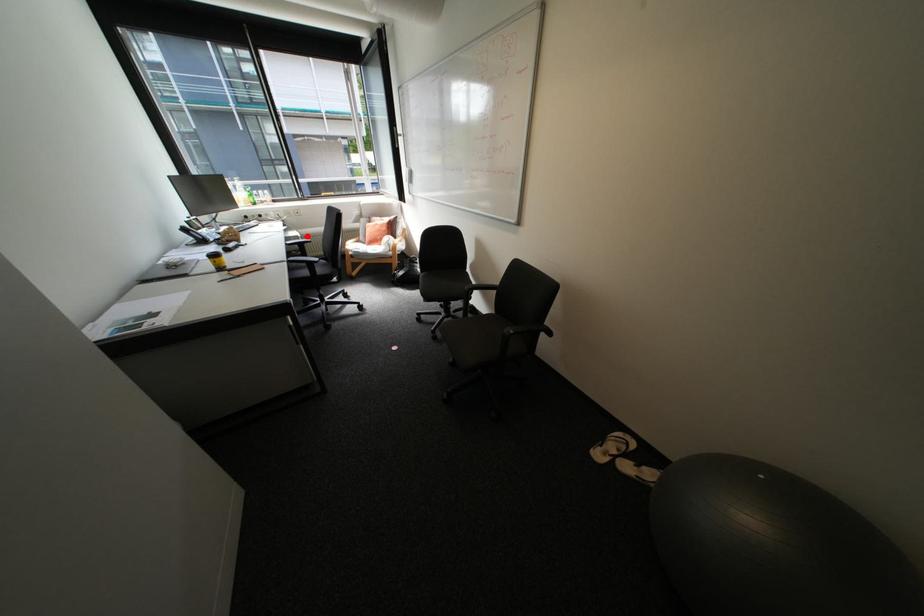
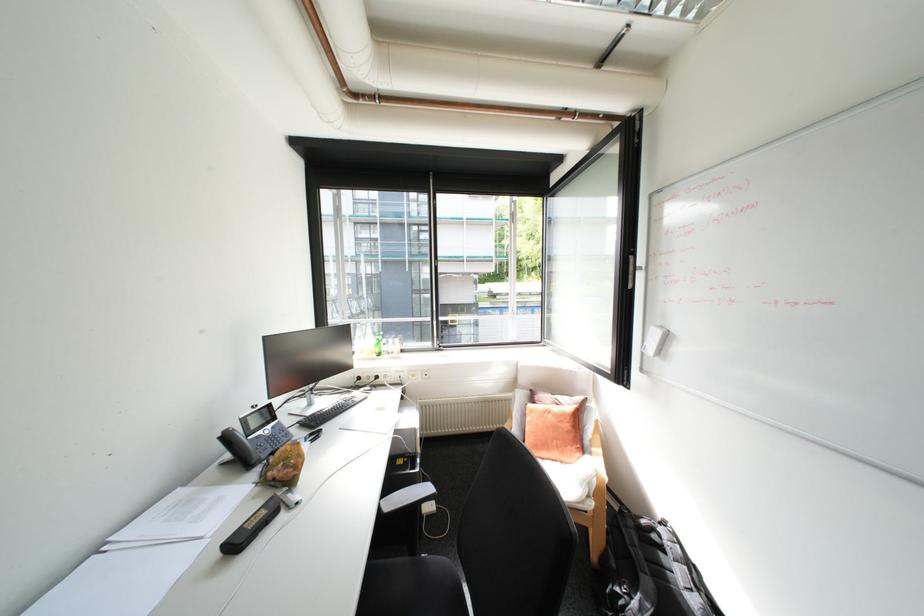
Question: I am providing you with two images of the same scene from different viewpoints. A red point is marked on the first image. Is the red point's position out of view in image 2?

Choices:
 (A) Yes
 (B) No

Answer: (B)